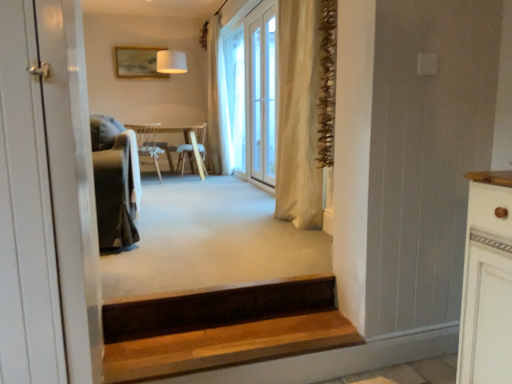
Describe the element at coordinates (217, 103) in the screenshot. I see `beige fabric curtain at center, the 2th curtain in the right-to-left sequence` at that location.

Image resolution: width=512 pixels, height=384 pixels. Describe the element at coordinates (148, 143) in the screenshot. I see `wooden chair at center, which appears as the second chair when viewed from the back` at that location.

Locate an element on the screen. This screenshot has height=384, width=512. clear glass door at center is located at coordinates (236, 97).

The width and height of the screenshot is (512, 384). Describe the element at coordinates (182, 154) in the screenshot. I see `wooden chair at center, the 2th chair viewed from the front` at that location.

What are the coordinates of `beige fabric curtain at center, the 2th curtain positioned from the front` in the screenshot? It's located at (217, 103).

Which of these two, wooden chair at center, the 2th chair viewed from the front, or clear glass door at center, is bigger?

With larger size is clear glass door at center.

From the image's perspective, count 1st chairs downward from the clear glass door at center and point to it. Please provide its 2D coordinates.

[(182, 154)]

Is wooden chair at center, arranged as the first chair when viewed from the back, wider than clear glass door at center?

Yes.

Is velvet green armchair at left facing away from wooden chair at center, which appears as the second chair when viewed from the back?

No.

In the image, is velvet green armchair at left positioned in front of or behind wooden chair at center, placed as the first chair when sorted from front to back?

Clearly, velvet green armchair at left is in front of wooden chair at center, placed as the first chair when sorted from front to back.

Considering the sizes of velvet green armchair at left and wooden chair at center, placed as the first chair when sorted from front to back, in the image, is velvet green armchair at left taller or shorter than wooden chair at center, placed as the first chair when sorted from front to back,?

Clearly, velvet green armchair at left is taller compared to wooden chair at center, placed as the first chair when sorted from front to back.

Between velvet green armchair at left and wooden chair at center, which appears as the second chair when viewed from the back, which one appears on the left side from the viewer's perspective?

Positioned to the left is wooden chair at center, which appears as the second chair when viewed from the back.

Is velvet green armchair at left looking in the opposite direction of wooden stairs at lower center?

No, velvet green armchair at left is not facing away from wooden stairs at lower center.

The image size is (512, 384). What are the coordinates of `armchair that is behind the wooden stairs at lower center` in the screenshot? It's located at (115, 182).

Is velvet green armchair at left in front of or behind wooden stairs at lower center in the image?

velvet green armchair at left is positioned farther from the viewer than wooden stairs at lower center.

From the picture: From a real-world perspective, is velvet green armchair at left positioned over wooden stairs at lower center based on gravity?

Yes, from a real-world perspective, velvet green armchair at left is on top of wooden stairs at lower center.

How much distance is there between wooden stairs at lower center and white wood door at left?

wooden stairs at lower center and white wood door at left are 22.39 inches apart from each other.

From a real-world perspective, does wooden stairs at lower center sit lower than white wood door at left?

Yes.

Would you say wooden stairs at lower center contains white wood door at left?

That's incorrect, white wood door at left is not inside wooden stairs at lower center.

Does wooden stairs at lower center have a smaller size compared to white wood door at left?

No.

Is clear glass door at center next to beige fabric curtain at center, placed as the 2th curtain when sorted from left to right, and touching it?

No, clear glass door at center is not in contact with beige fabric curtain at center, placed as the 2th curtain when sorted from left to right.

Can you confirm if clear glass door at center is bigger than beige fabric curtain at center, placed as the 2th curtain when sorted from left to right?

Indeed, clear glass door at center has a larger size compared to beige fabric curtain at center, placed as the 2th curtain when sorted from left to right.

Is clear glass door at center oriented away from beige fabric curtain at center, the first curtain in the front-to-back sequence?

No, clear glass door at center's orientation is not away from beige fabric curtain at center, the first curtain in the front-to-back sequence.

From the image's perspective, which one is positioned higher, clear glass door at center or beige fabric curtain at center, the first curtain in the front-to-back sequence?

clear glass door at center.

Is clear glass door at center thinner than wooden chair at center, arranged as the first chair when viewed from the back?

Yes, clear glass door at center is thinner than wooden chair at center, arranged as the first chair when viewed from the back.

Is clear glass door at center facing away from wooden chair at center, arranged as the first chair when viewed from the back?

No, clear glass door at center is not facing away from wooden chair at center, arranged as the first chair when viewed from the back.

Is clear glass door at center taller or shorter than wooden chair at center, the 2th chair viewed from the front?

Clearly, clear glass door at center is taller compared to wooden chair at center, the 2th chair viewed from the front.

From the image's perspective, is clear glass door at center below wooden chair at center, arranged as the first chair when viewed from the back?

No.

Locate an element on the screen. This screenshot has width=512, height=384. curtain above the beige fabric curtain at center, placed as the 2th curtain when sorted from left to right (from the image's perspective) is located at coordinates (217, 103).

Which is in front, point (213, 35) or point (288, 36)?

Positioned in front is point (288, 36).

Could you tell me if beige fabric curtain at center, the 1th curtain when ordered from left to right, is facing beige fabric curtain at center, the 1th curtain from the right?

No, beige fabric curtain at center, the 1th curtain when ordered from left to right, does not turn towards beige fabric curtain at center, the 1th curtain from the right.

Can you confirm if beige fabric curtain at center, the 2th curtain positioned from the front, is wider than beige fabric curtain at center, the first curtain in the front-to-back sequence?

No.

Where is `chair behind the clear glass door at center`? The image size is (512, 384). chair behind the clear glass door at center is located at coordinates (182, 154).

I want to click on the 1st chair directly beneath the velvet green armchair at left (from a real-world perspective), so point(148,143).

Consider the image. When comparing their distances from clear glass door at center, does wooden chair at center, placed as the first chair when sorted from front to back, or beige fabric curtain at center, the 1th curtain when ordered from left to right, seem closer?

beige fabric curtain at center, the 1th curtain when ordered from left to right, is closer to clear glass door at center.

Looking at the image, which one is located further to wooden stairs at lower center, wooden chair at center, which appears as the second chair when viewed from the back, or beige fabric curtain at center, the 1th curtain from the right?

wooden chair at center, which appears as the second chair when viewed from the back, is further to wooden stairs at lower center.

Based on their spatial positions, is velvet green armchair at left or white wood door at left further from wooden chair at center, placed as the first chair when sorted from front to back?

white wood door at left is further to wooden chair at center, placed as the first chair when sorted from front to back.

Estimate the real-world distances between objects in this image. Which object is closer to wooden chair at center, which appears as the second chair when viewed from the back, wooden chair at center, arranged as the first chair when viewed from the back, or beige fabric curtain at center, the first curtain in the front-to-back sequence?

wooden chair at center, arranged as the first chair when viewed from the back, lies closer to wooden chair at center, which appears as the second chair when viewed from the back, than the other object.

Estimate the real-world distances between objects in this image. Which object is further from beige fabric curtain at center, the first curtain in the front-to-back sequence, wooden chair at center, which appears as the second chair when viewed from the back, or velvet green armchair at left?

wooden chair at center, which appears as the second chair when viewed from the back, lies further to beige fabric curtain at center, the first curtain in the front-to-back sequence, than the other object.

Looking at this image, which object lies nearer to the anchor point beige fabric curtain at center, the 1th curtain from the right, beige fabric curtain at center, the 2th curtain in the right-to-left sequence, or clear glass door at center?

clear glass door at center.

Based on their spatial positions, is beige fabric curtain at center, the 2th curtain positioned from the front, or beige fabric curtain at center, which appears as the 2th curtain when viewed from the back, closer to white wood door at left?

Based on the image, beige fabric curtain at center, which appears as the 2th curtain when viewed from the back, appears to be nearer to white wood door at left.

When comparing their distances from wooden chair at center, placed as the first chair when sorted from front to back, does wooden chair at center, the 2th chair viewed from the front, or white wood door at left seem further?

white wood door at left is positioned further to the anchor wooden chair at center, placed as the first chair when sorted from front to back.

Image resolution: width=512 pixels, height=384 pixels. I want to click on curtain between white wood door at left and beige fabric curtain at center, the 2th curtain in the right-to-left sequence, from front to back, so click(298, 116).

At what (x,y) coordinates should I click in order to perform the action: click on window screen between wooden stairs at lower center and wooden chair at center, the 2th chair viewed from the front, in the front-back direction. Please return your answer as a coordinate pair (x, y). The height and width of the screenshot is (384, 512). Looking at the image, I should click on click(236, 97).

I want to click on chair between beige fabric curtain at center, the 2th curtain positioned from the front, and wooden chair at center, placed as the first chair when sorted from front to back, from top to bottom, so click(182, 154).

In order to click on armchair positioned between white wood door at left and beige fabric curtain at center, which appears as the 2th curtain when viewed from the back, from near to far in this screenshot , I will do `click(115, 182)`.